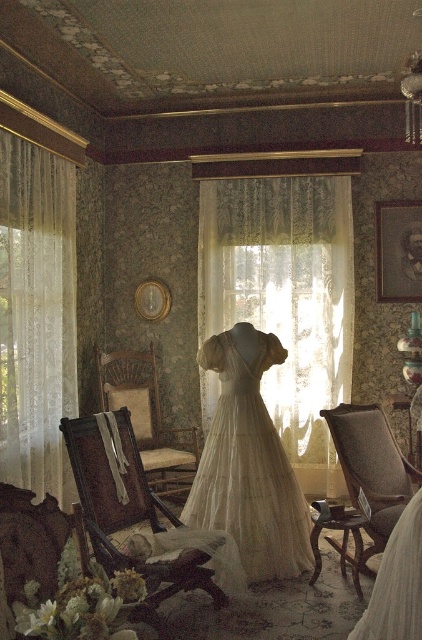
Question: Which object is the farthest from the velvet upholstered armchair at center?

Choices:
 (A) white lace curtain at center
 (B) translucent white fabric dress at center

Answer: (A)

Question: Which object is closer to the camera taking this photo?

Choices:
 (A) white lace curtain at left
 (B) white lace curtain at center

Answer: (A)

Question: Is white lace curtain at left positioned behind wooden armchair at center?

Choices:
 (A) yes
 (B) no

Answer: (A)

Question: Is white lace curtain at center further to the viewer compared to velvet upholstered armchair at center?

Choices:
 (A) yes
 (B) no

Answer: (A)

Question: Can you confirm if wooden armchair at center is thinner than brown woven armchair at center?

Choices:
 (A) yes
 (B) no

Answer: (B)

Question: Which of these objects is positioned farthest from the velvet upholstered armchair at center?

Choices:
 (A) wooden armchair at center
 (B) white lace curtain at center
 (C) white lace curtain at left
 (D) brown woven armchair at center

Answer: (C)